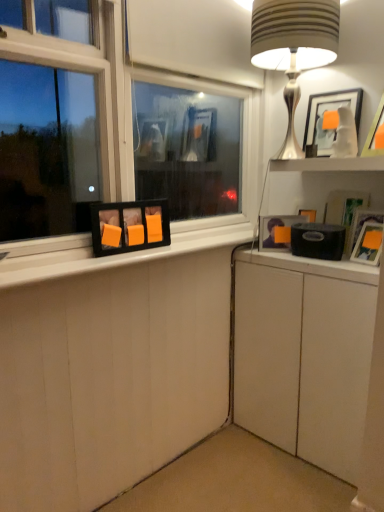
Question: Is matte white picture frame at upper right, the third picture frame from the left, thinner than white glossy shelf at upper right?

Choices:
 (A) no
 (B) yes

Answer: (B)

Question: Is matte white picture frame at upper right, acting as the 2th picture frame starting from the right, outside white glossy shelf at upper right?

Choices:
 (A) no
 (B) yes

Answer: (B)

Question: Does matte white picture frame at upper right, the third picture frame from the left, have a lesser height compared to white glossy shelf at upper right?

Choices:
 (A) no
 (B) yes

Answer: (A)

Question: From a real-world perspective, is matte white picture frame at upper right, the third picture frame from the left, beneath white glossy shelf at upper right?

Choices:
 (A) yes
 (B) no

Answer: (B)

Question: Is matte white picture frame at upper right, acting as the 2th picture frame starting from the right, beside white glossy shelf at upper right?

Choices:
 (A) yes
 (B) no

Answer: (B)

Question: From a real-world perspective, is matte white picture frame at upper right, acting as the 2th picture frame starting from the right, above or below orange matte picture frame at lower left, which ranks as the 4th picture frame in right-to-left order?

Choices:
 (A) below
 (B) above

Answer: (B)

Question: Is matte white picture frame at upper right, acting as the 2th picture frame starting from the right, situated inside orange matte picture frame at lower left, positioned as the first picture frame in left-to-right order, or outside?

Choices:
 (A) outside
 (B) inside

Answer: (A)

Question: In terms of height, does matte white picture frame at upper right, the third picture frame from the left, look taller or shorter compared to orange matte picture frame at lower left, which ranks as the 4th picture frame in right-to-left order?

Choices:
 (A) tall
 (B) short

Answer: (A)

Question: Would you say matte white picture frame at upper right, acting as the 2th picture frame starting from the right, is to the left or to the right of orange matte picture frame at lower left, which ranks as the 4th picture frame in right-to-left order, in the picture?

Choices:
 (A) right
 (B) left

Answer: (A)

Question: Relative to satin silver table lamp at upper right, is white glossy shelf at upper right in front or behind?

Choices:
 (A) front
 (B) behind

Answer: (B)

Question: Does point (301, 163) appear closer or farther from the camera than point (291, 83)?

Choices:
 (A) farther
 (B) closer

Answer: (A)

Question: Considering the relative positions of white glossy shelf at upper right and satin silver table lamp at upper right in the image provided, is white glossy shelf at upper right to the left or to the right of satin silver table lamp at upper right?

Choices:
 (A) right
 (B) left

Answer: (A)

Question: Would you say white glossy shelf at upper right is inside or outside satin silver table lamp at upper right?

Choices:
 (A) inside
 (B) outside

Answer: (B)

Question: Considering the positions of matte black frame at left and matte white picture frame at upper right, acting as the 2th picture frame starting from the right, in the image, is matte black frame at left taller or shorter than matte white picture frame at upper right, acting as the 2th picture frame starting from the right,?

Choices:
 (A) short
 (B) tall

Answer: (A)

Question: From the image's perspective, relative to matte white picture frame at upper right, acting as the 2th picture frame starting from the right, is matte black frame at left above or below?

Choices:
 (A) below
 (B) above

Answer: (A)